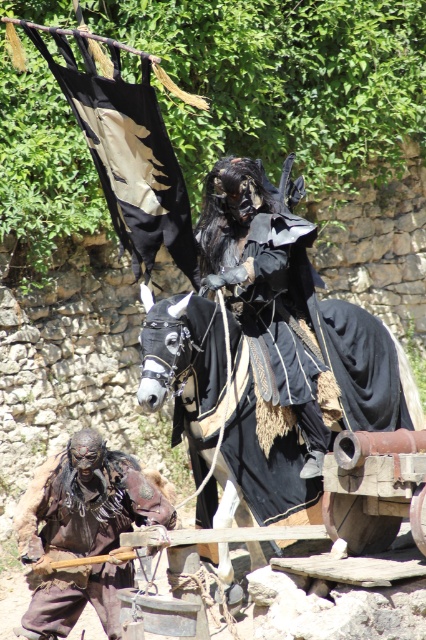
Question: Estimate the real-world distances between objects in this image. Which object is farther from the rusty metal armor at lower left?

Choices:
 (A) black leather horse at center
 (B) black matte costume at center

Answer: (B)

Question: Is the position of black leather horse at center more distant than that of black matte costume at center?

Choices:
 (A) yes
 (B) no

Answer: (B)

Question: Which is farther from the black leather horse at center?

Choices:
 (A) black matte costume at center
 (B) rusty metal armor at lower left

Answer: (A)

Question: Where is black leather horse at center located in relation to black matte costume at center in the image?

Choices:
 (A) below
 (B) above

Answer: (A)

Question: Can you confirm if black leather horse at center is wider than rusty metal armor at lower left?

Choices:
 (A) no
 (B) yes

Answer: (A)

Question: Based on their relative distances, which object is farther from the black leather horse at center?

Choices:
 (A) black matte costume at center
 (B) rusty metal armor at lower left

Answer: (A)